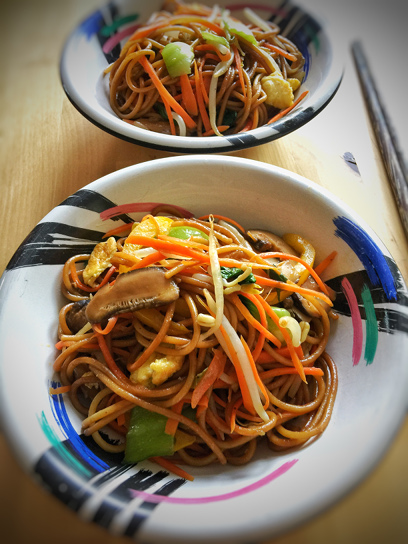
Where is `chopsticks`? Image resolution: width=408 pixels, height=544 pixels. chopsticks is located at coordinates 386,141, 396,141.